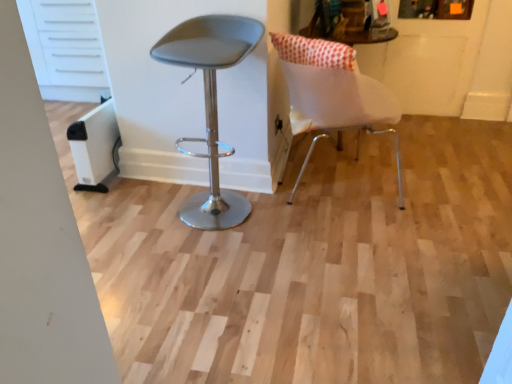
Find the location of a particular element. This screenshot has width=512, height=384. free point below matte gray stool at center, the second chair from the right (from a real-world perspective) is located at coordinates (229, 213).